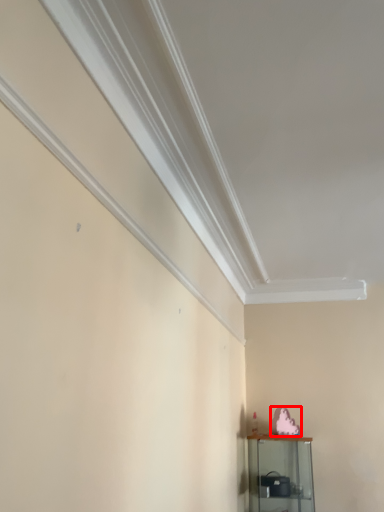
Question: From the image's perspective, where is animal (annotated by the red box) located in relation to shelf in the image?

Choices:
 (A) above
 (B) below

Answer: (A)